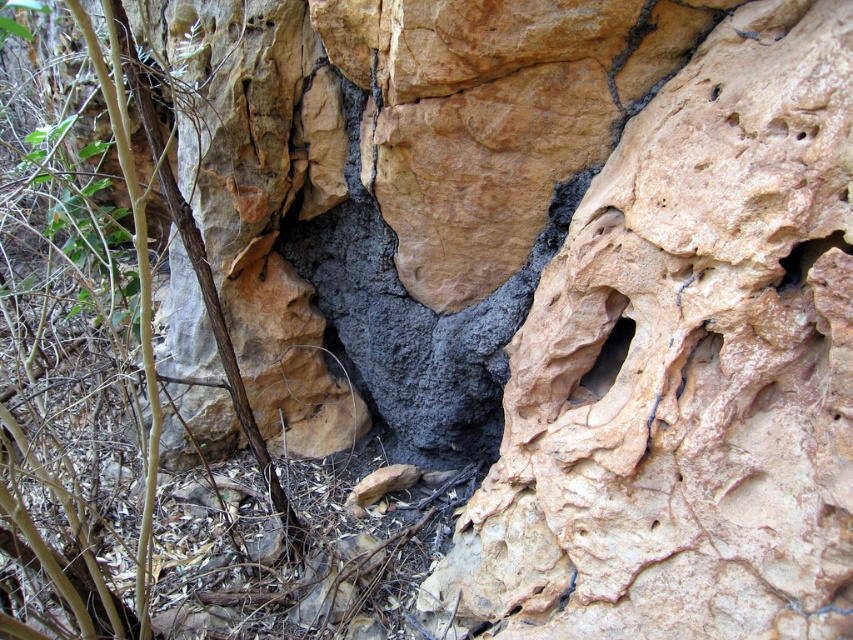
Question: Is smooth stone hole at center wider than smooth gray rock at upper right?

Choices:
 (A) no
 (B) yes

Answer: (B)

Question: Does smooth stone hole at center appear on the left side of smooth gray rock at upper right?

Choices:
 (A) yes
 (B) no

Answer: (A)

Question: Which of the following is the closest to the observer?

Choices:
 (A) (782, 259)
 (B) (592, 365)

Answer: (A)

Question: Observing the image, what is the correct spatial positioning of smooth stone hole at center in reference to smooth gray rock at upper right?

Choices:
 (A) above
 (B) below

Answer: (B)

Question: Among these points, which one is nearest to the camera?

Choices:
 (A) (596, 371)
 (B) (808, 264)

Answer: (B)

Question: Which point is closer to the camera?

Choices:
 (A) smooth gray rock at upper right
 (B) smooth stone hole at center

Answer: (A)